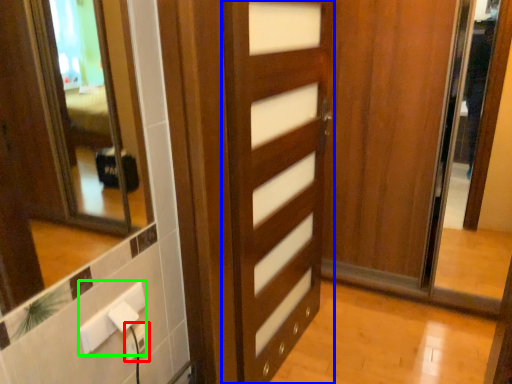
Question: Considering the real-world distances, which object is closest to electric outlet (highlighted by a red box)? door (highlighted by a blue box) or electric outlet (highlighted by a green box).

Choices:
 (A) door
 (B) electric outlet

Answer: (B)